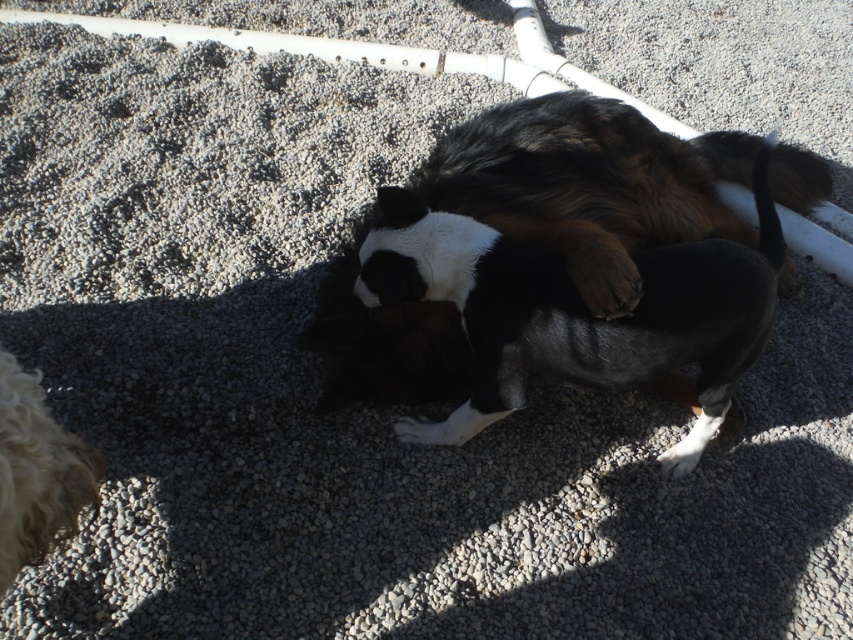
You are a photographer standing at the scene. You want to take a closeup photo of the black and white fur at center. The camera requires you to be within 1.5 meters to focus properly. Can you get a clear closeup without moving the dog?

The distance of black and white fur at center from camera is 1.73 meters. Since the camera requires being within 1.5 meters for proper focus, you cannot get a clear closeup without moving the dog closer.

You are a photographer trying to capture the dog in the image. You notice the curly golden fur at lower left and the white fur at center. Which area should you focus on if you want to highlight the contrast between light and shadow?

The curly golden fur at lower left should be focused on because it is much taller than the white fur at center, creating a more pronounced contrast between light and shadow due to its height.